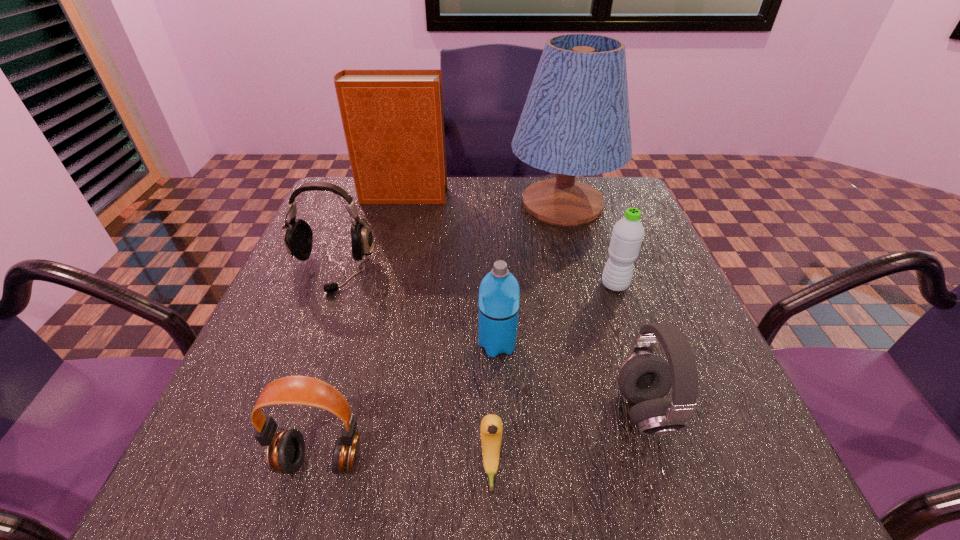
You are a GUI agent. You are given a task and a screenshot of the screen. Output one action in this format:
    pyautogui.click(x=<x>, y=<y>)
    Task: Click on the closest headset to the seventh shortest object
    The height and width of the screenshot is (540, 960).
    Given the screenshot: What is the action you would take?
    pyautogui.click(x=297, y=234)

Image resolution: width=960 pixels, height=540 pixels. Identify the location of headset identified as the third closest to the hardback book. (285, 450).

Find the location of a particular element. vacant space that satisfies the following two spatial constraints: 1. on the open cover of the hardback book; 2. on the right side of the water bottle is located at coordinates (380, 285).

The image size is (960, 540). I want to click on blank space that satisfies the following two spatial constraints: 1. with the microphone on the side of the farthest headset; 2. on the right side of the water bottle, so click(x=325, y=285).